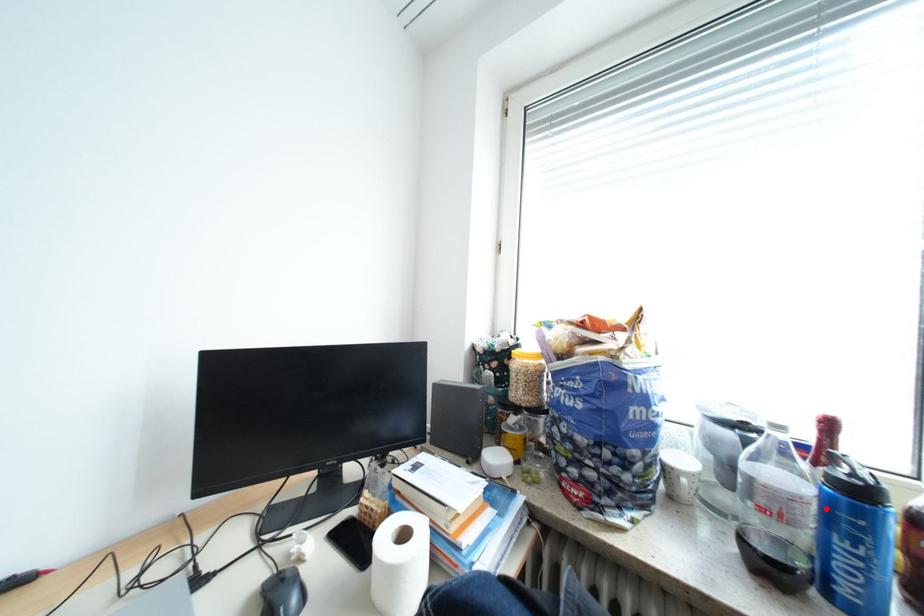
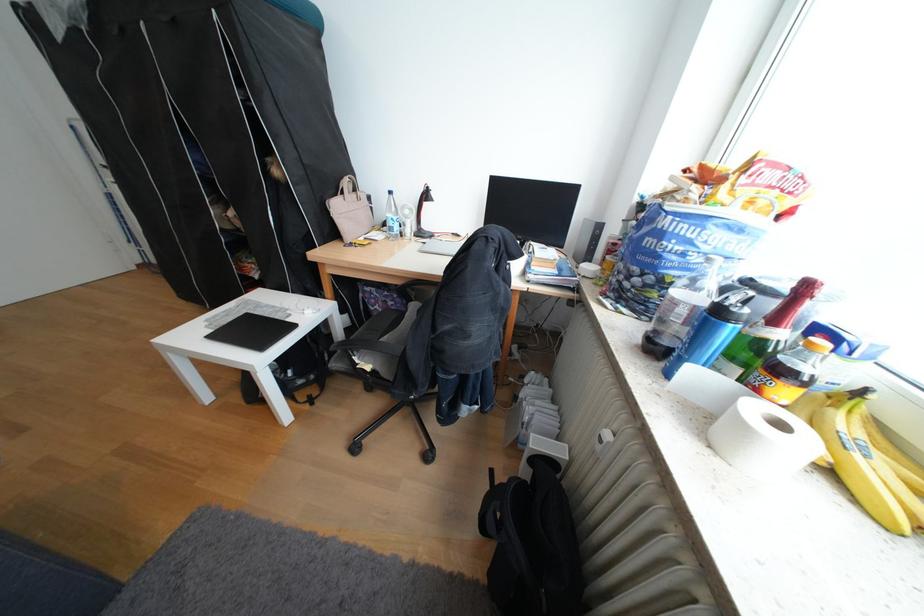
Locate, in the second image, the point that corresponds to the highlighted location in the first image.

(695, 312)